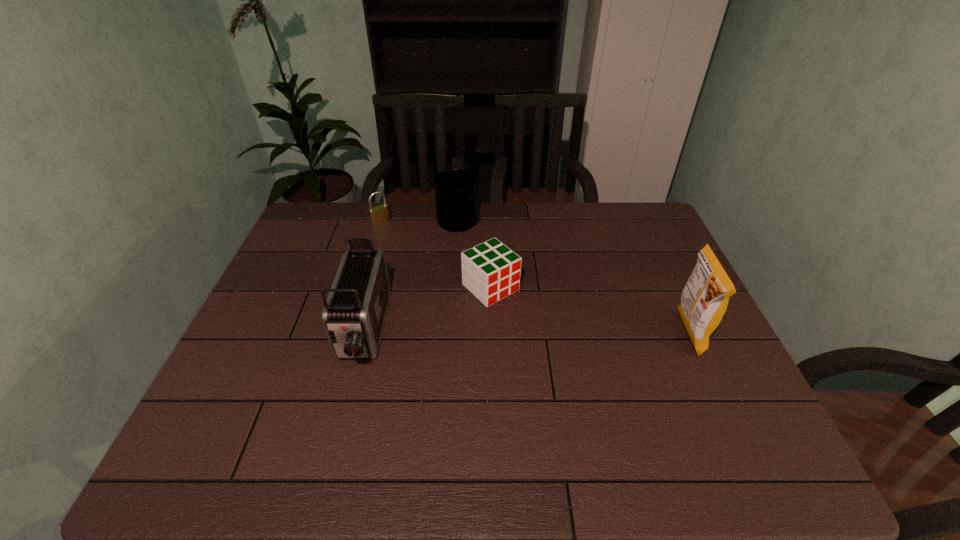
Locate an element on the screen. free area in between the camcorder and the cube is located at coordinates (427, 309).

The height and width of the screenshot is (540, 960). I want to click on vacant space that is in between the third shortest object and the rightmost object, so click(572, 279).

At what (x,y) coordinates should I click in order to perform the action: click on object that is the third nearest to the padlock. Please return your answer as a coordinate pair (x, y). Looking at the image, I should click on (491, 271).

Identify which object is located as the second nearest to the third tallest object. Please provide its 2D coordinates. Your answer should be formatted as a tuple, i.e. [(x, y)], where the tuple contains the x and y coordinates of a point satisfying the conditions above.

[(380, 214)]

What are the coordinates of `free space that satisfies the following two spatial constraints: 1. on the front side of the third shortest object; 2. on the front of the rightmost object with the logo` in the screenshot? It's located at (449, 334).

I want to click on free space in the image that satisfies the following two spatial constraints: 1. on the front side of the padlock; 2. on the left side of the cube, so click(x=362, y=287).

The width and height of the screenshot is (960, 540). I want to click on free spot that satisfies the following two spatial constraints: 1. on the front side of the rightmost object; 2. on the front of the cube with the logo, so click(492, 334).

Where is `free space that satisfies the following two spatial constraints: 1. at the lens of the rightmost object; 2. on the front of the camcorder with the logo`? free space that satisfies the following two spatial constraints: 1. at the lens of the rightmost object; 2. on the front of the camcorder with the logo is located at coordinates (363, 334).

You are a GUI agent. You are given a task and a screenshot of the screen. Output one action in this format:
    pyautogui.click(x=<x>, y=<y>)
    Task: Click on the vacant space that satisfies the following two spatial constraints: 1. at the lens of the camcorder; 2. on the front of the crisp (potato chip) with the logo
    Image resolution: width=960 pixels, height=540 pixels.
    Given the screenshot: What is the action you would take?
    pyautogui.click(x=363, y=334)